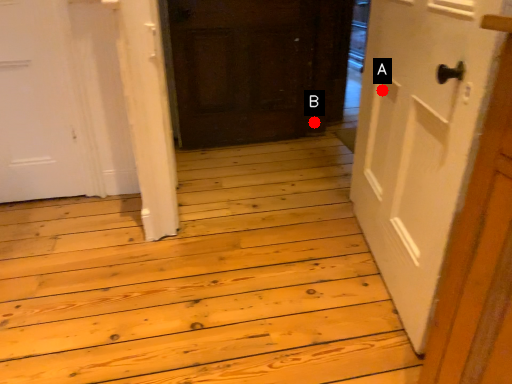
Question: Two points are circled on the image, labeled by A and B beside each circle. Which point is closer to the camera taking this photo?

Choices:
 (A) A is closer
 (B) B is closer

Answer: (A)